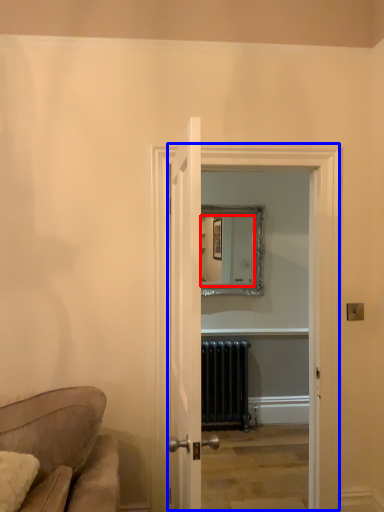
Question: Which object is further to the camera taking this photo, mirror (highlighted by a red box) or glass door (highlighted by a blue box)?

Choices:
 (A) mirror
 (B) glass door

Answer: (A)